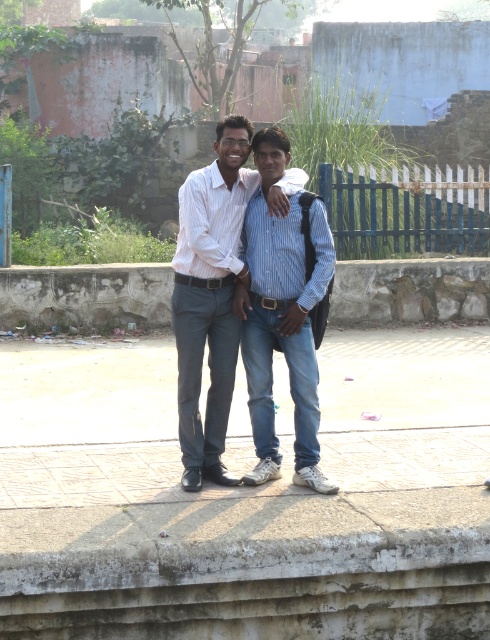
Is blue striped shirt at center behind blue painted wood fence at upper center?

No, blue striped shirt at center is in front of blue painted wood fence at upper center.

Between point (269, 336) and point (457, 180), which one is positioned behind?

The point (457, 180) is more distant.

Image resolution: width=490 pixels, height=640 pixels. I want to click on blue striped shirt at center, so click(x=282, y=316).

Can you confirm if matte white shirt at center is positioned below blue striped shirt at center?

Incorrect, matte white shirt at center is not positioned below blue striped shirt at center.

Can you confirm if matte white shirt at center is shorter than blue striped shirt at center?

Yes, matte white shirt at center is shorter than blue striped shirt at center.

Does point (239, 195) come behind point (295, 324)?

Yes, point (239, 195) is behind point (295, 324).

Find the location of a particular element. The image size is (490, 640). matte white shirt at center is located at coordinates (210, 298).

This screenshot has width=490, height=640. In order to click on matte white shirt at center in this screenshot , I will do `click(210, 298)`.

Who is taller, matte white shirt at center or blue painted wood fence at upper center?

Standing taller between the two is matte white shirt at center.

Is point (225, 116) less distant than point (378, 189)?

No.

Where is `matte white shirt at center`? matte white shirt at center is located at coordinates (210, 298).